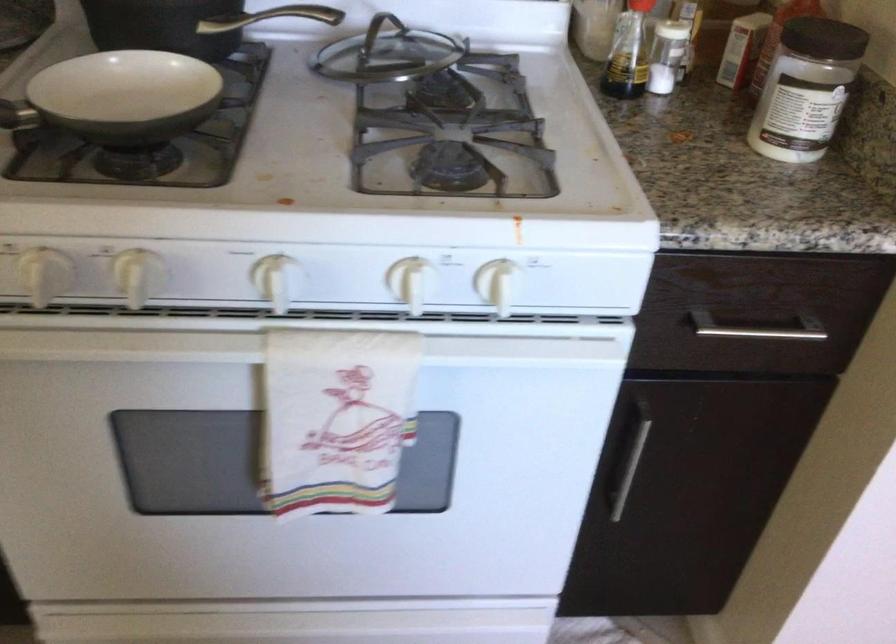
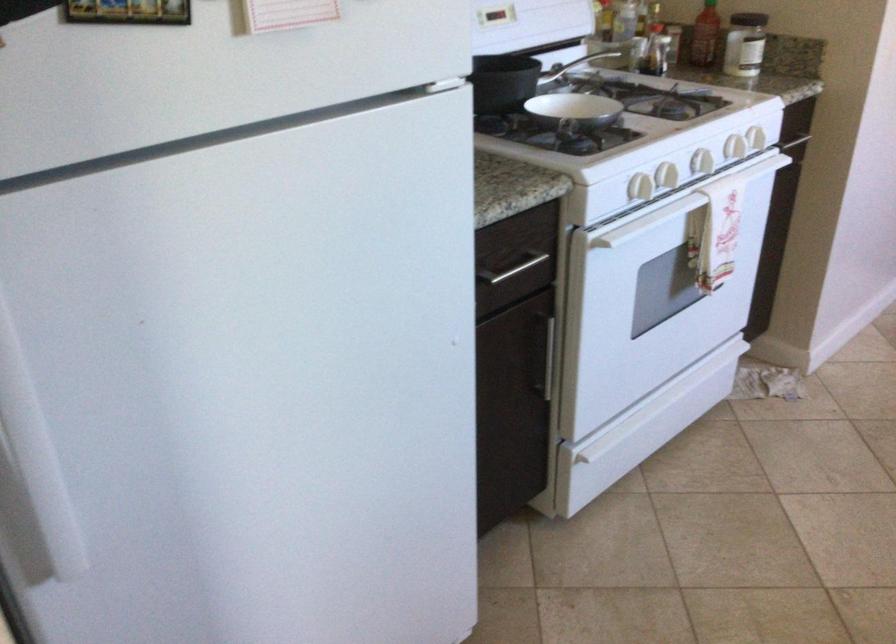
Where in the second image is the point corresponding to pixel 675 169 from the first image?

(745, 44)